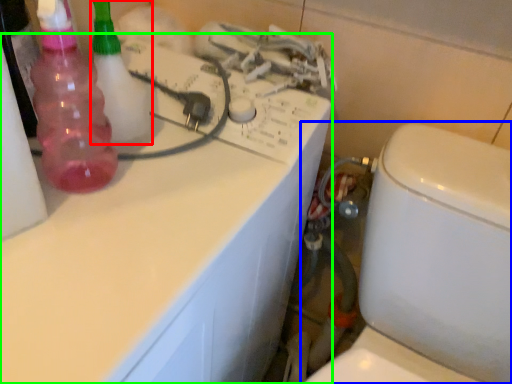
Question: Which object is positioned closest to cleaning product (highlighted by a red box)? Select from toilet (highlighted by a blue box) and counter top (highlighted by a green box).

Choices:
 (A) toilet
 (B) counter top

Answer: (B)